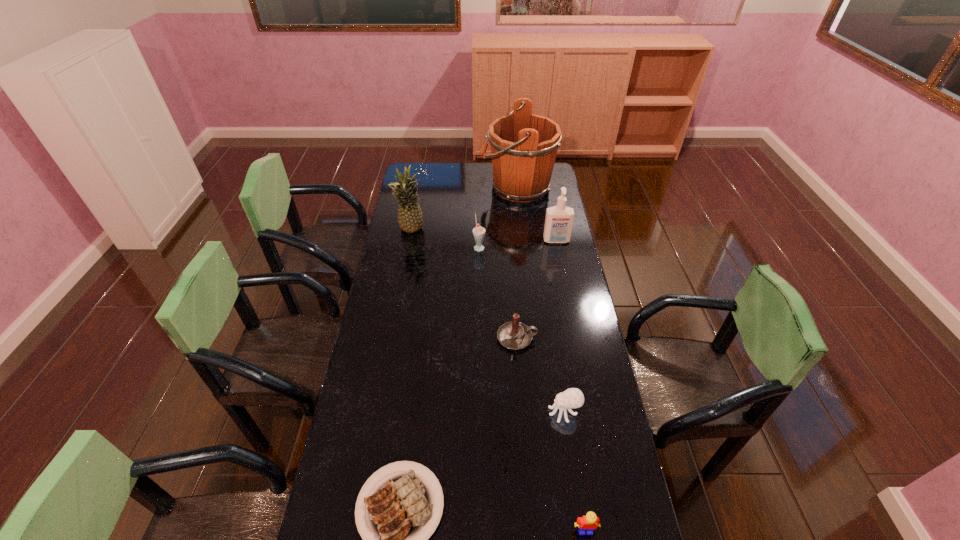
At what (x,y) coordinates should I click in order to perform the action: click on free space between the sixth farthest object and the candle. Please return your answer as a coordinate pair (x, y). Looking at the image, I should click on (540, 375).

Find the location of a particular element. This screenshot has width=960, height=540. free space between the second tallest object and the fourth tallest object is located at coordinates (445, 239).

In order to click on vacant point located between the sixth shortest object and the bucket in this screenshot , I will do `click(537, 214)`.

You are a GUI agent. You are given a task and a screenshot of the screen. Output one action in this format:
    pyautogui.click(x=<x>, y=<y>)
    Task: Click on the free space between the second tallest object and the octopus
    This screenshot has width=960, height=540.
    Given the screenshot: What is the action you would take?
    pyautogui.click(x=488, y=321)

Find the location of a particular element. This screenshot has height=540, width=960. vacant area that lies between the milkshake and the sixth shortest object is located at coordinates (517, 244).

This screenshot has height=540, width=960. In order to click on object that is the third closest to the pineapple in this screenshot , I will do click(x=559, y=219).

Identify the location of the second closest object relative to the Lego. (398, 513).

Image resolution: width=960 pixels, height=540 pixels. Find the location of `blank area in the image that satisfies the following two spatial constraints: 1. on the front label of the cleansing agent; 2. on the side of the candle with the handle loop`. blank area in the image that satisfies the following two spatial constraints: 1. on the front label of the cleansing agent; 2. on the side of the candle with the handle loop is located at coordinates point(575,338).